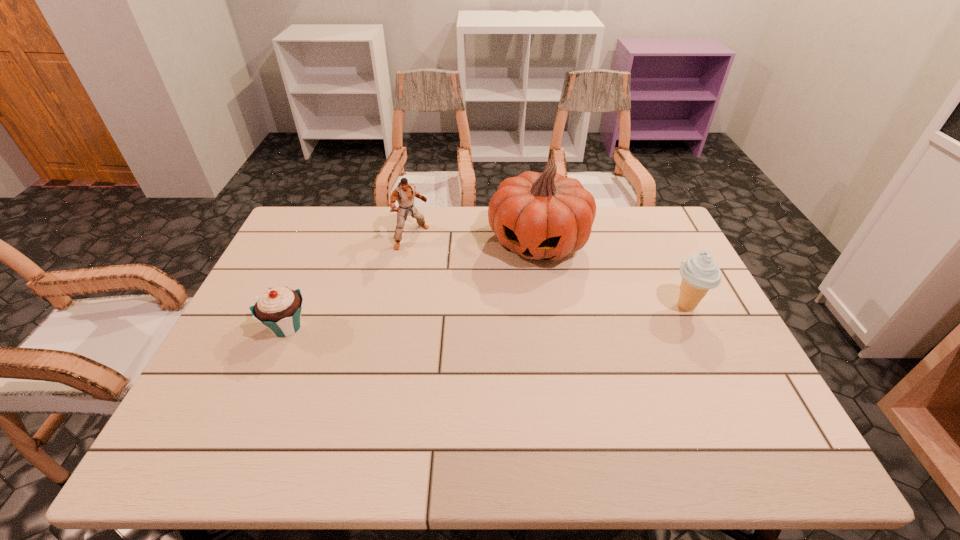
You are a GUI agent. You are given a task and a screenshot of the screen. Output one action in this format:
    pyautogui.click(x=<x>, y=<y>)
    Task: Click on the leftmost object
    
    Given the screenshot: What is the action you would take?
    point(279,309)

This screenshot has width=960, height=540. I want to click on the shortest object, so click(279, 309).

Locate an element on the screen. icecream is located at coordinates (699, 272).

In order to click on puncher in this screenshot , I will do `click(405, 193)`.

The height and width of the screenshot is (540, 960). Find the location of `pumpkin`. pumpkin is located at coordinates (540, 216).

You are a GUI agent. You are given a task and a screenshot of the screen. Output one action in this format:
    pyautogui.click(x=<x>, y=<y>)
    Task: Click on the third object from left to right
    
    Given the screenshot: What is the action you would take?
    pyautogui.click(x=540, y=216)

Locate an element on the screen. free region located 0.290m on the back of the leftmost object is located at coordinates (323, 244).

Find the location of a particular element. This screenshot has width=960, height=540. free space located on the back of the rightmost object is located at coordinates (660, 251).

Locate an element on the screen. This screenshot has height=540, width=960. vacant area situated 0.180m on the front-facing side of the second object from left to right is located at coordinates (459, 275).

Locate an element on the screen. free spot located 0.310m on the front-facing side of the second object from left to right is located at coordinates pyautogui.click(x=489, y=299).